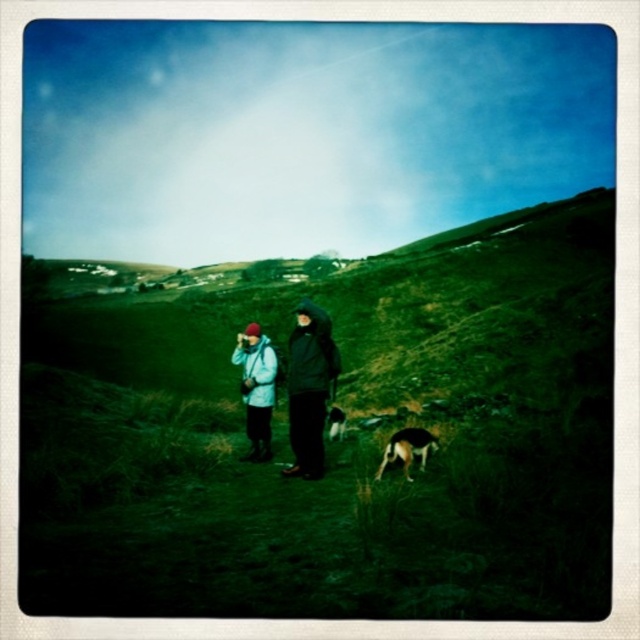
Between point (250, 380) and point (406, 465), which one is positioned behind?

Point (250, 380)

Who is shorter, light blue fabric jacket at center or brown fur dog at lower center?

brown fur dog at lower center

Where is `light blue fabric jacket at center`? Image resolution: width=640 pixels, height=640 pixels. light blue fabric jacket at center is located at coordinates click(x=257, y=387).

Can you confirm if brown fur dog at lower center is wider than brown fur dog at center?

Correct, the width of brown fur dog at lower center exceeds that of brown fur dog at center.

Between brown fur dog at lower center and brown fur dog at center, which one is positioned higher?

brown fur dog at lower center is above.

What do you see at coordinates (406, 449) in the screenshot?
I see `brown fur dog at lower center` at bounding box center [406, 449].

Locate an element on the screen. brown fur dog at lower center is located at coordinates (406, 449).

Is light blue fabric jacket at center thinner than brown fur dog at center?

No, light blue fabric jacket at center is not thinner than brown fur dog at center.

Can you confirm if light blue fabric jacket at center is smaller than brown fur dog at center?

No.

Between point (250, 429) and point (337, 419), which one is positioned behind?

Positioned behind is point (337, 419).

I want to click on light blue fabric jacket at center, so click(x=257, y=387).